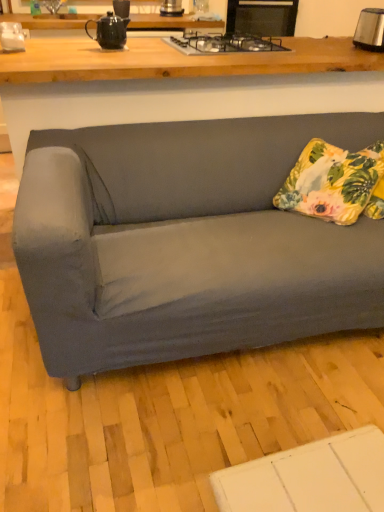
This screenshot has width=384, height=512. Describe the element at coordinates (179, 84) in the screenshot. I see `matte wood desk at upper center` at that location.

The height and width of the screenshot is (512, 384). In order to click on floral fabric pillow at right in this screenshot , I will do `click(335, 183)`.

In the scene shown: What is the approximate width of black glass gas stove at upper center?

51.57 centimeters.

Describe the element at coordinates (108, 31) in the screenshot. I see `matte black teapot at upper center` at that location.

The image size is (384, 512). Find the location of `matte wood desk at upper center`. matte wood desk at upper center is located at coordinates (179, 84).

From a real-world perspective, which object rests below the other?

In real-world perspective, floral fabric pillow at right is lower.

Is satin silver toaster at upper right positioned with its back to floral fabric pillow at right?

No, satin silver toaster at upper right is not facing the opposite direction of floral fabric pillow at right.

At what (x,y) coordinates should I click in order to perform the action: click on pillow to the left of satin silver toaster at upper right. Please return your answer as a coordinate pair (x, y). Looking at the image, I should click on (335, 183).

Is satin silver toaster at upper right taller than floral fabric pillow at right?

In fact, satin silver toaster at upper right may be shorter than floral fabric pillow at right.

Relative to black glass gas stove at upper center, is satin silver toaster at upper right in front or behind?

Visually, satin silver toaster at upper right is located behind black glass gas stove at upper center.

Based on the photo, from a real-world perspective, between satin silver toaster at upper right and black glass gas stove at upper center, who is vertically lower?

black glass gas stove at upper center.

Choose the correct answer: Is satin silver toaster at upper right inside black glass gas stove at upper center or outside it?

satin silver toaster at upper right lies outside black glass gas stove at upper center.

Is satin silver toaster at upper right looking in the opposite direction of black glass gas stove at upper center?

No, satin silver toaster at upper right is not facing away from black glass gas stove at upper center.

What's the angular difference between floral fabric pillow at right and black glass gas stove at upper center's facing directions?

The angle between the facing direction of floral fabric pillow at right and the facing direction of black glass gas stove at upper center is 125 degrees.

Are floral fabric pillow at right and black glass gas stove at upper center located far from each other?

Actually, floral fabric pillow at right and black glass gas stove at upper center are a little close together.

From the picture: Could you tell me if floral fabric pillow at right is turned towards black glass gas stove at upper center?

No, floral fabric pillow at right is not facing towards black glass gas stove at upper center.

Which object is wider, white glossy coffee maker at upper left, the 1th appliance in the left-to-right sequence, or metallic silver toaster at upper center, placed as the second appliance when sorted from left to right?

metallic silver toaster at upper center, placed as the second appliance when sorted from left to right, is wider.

Can you confirm if white glossy coffee maker at upper left, the 2th appliance when ordered from top to bottom, is positioned to the right of metallic silver toaster at upper center, which appears as the 2th appliance when ordered from the bottom?

No, white glossy coffee maker at upper left, the 2th appliance when ordered from top to bottom, is not to the right of metallic silver toaster at upper center, which appears as the 2th appliance when ordered from the bottom.

From the image's perspective, which object appears higher, white glossy coffee maker at upper left, which ranks as the first appliance in front-to-back order, or metallic silver toaster at upper center, the 1th appliance from the back?

metallic silver toaster at upper center, the 1th appliance from the back.

Are white glossy coffee maker at upper left, the 1th appliance when ordered from bottom to top, and metallic silver toaster at upper center, positioned as the first appliance in right-to-left order, far apart?

white glossy coffee maker at upper left, the 1th appliance when ordered from bottom to top, is far away from metallic silver toaster at upper center, positioned as the first appliance in right-to-left order.

Based on the photo, is floral fabric pillow at right facing towards satin silver toaster at upper right?

No, floral fabric pillow at right is not aimed at satin silver toaster at upper right.

Which of these two, floral fabric pillow at right or satin silver toaster at upper right, is wider?

floral fabric pillow at right.

From a real-world perspective, between floral fabric pillow at right and satin silver toaster at upper right, who is vertically higher?

satin silver toaster at upper right, from a real-world perspective.

Which of these two, floral fabric pillow at right or satin silver toaster at upper right, is bigger?

floral fabric pillow at right is bigger.

In terms of size, does metallic silver toaster at upper center, positioned as the first appliance in right-to-left order, appear bigger or smaller than matte wood desk at upper center?

metallic silver toaster at upper center, positioned as the first appliance in right-to-left order, is smaller than matte wood desk at upper center.

Can you confirm if metallic silver toaster at upper center, which appears as the 2th appliance when ordered from the bottom, is positioned to the left of matte wood desk at upper center?

Indeed, metallic silver toaster at upper center, which appears as the 2th appliance when ordered from the bottom, is positioned on the left side of matte wood desk at upper center.

From the image's perspective, who appears lower, metallic silver toaster at upper center, placed as the second appliance when sorted from left to right, or matte wood desk at upper center?

matte wood desk at upper center.

Which is in front, metallic silver toaster at upper center, acting as the first appliance starting from the top, or matte wood desk at upper center?

matte wood desk at upper center.

Is black glass gas stove at upper center at the right side of white glossy coffee maker at upper left, the 2th appliance when ordered from top to bottom?

Indeed, black glass gas stove at upper center is positioned on the right side of white glossy coffee maker at upper left, the 2th appliance when ordered from top to bottom.

What's the angular difference between black glass gas stove at upper center and white glossy coffee maker at upper left, the 1th appliance when ordered from bottom to top,'s facing directions?

The angle between the facing direction of black glass gas stove at upper center and the facing direction of white glossy coffee maker at upper left, the 1th appliance when ordered from bottom to top, is 0.00178 degrees.

Looking at this image, considering the sizes of objects black glass gas stove at upper center and white glossy coffee maker at upper left, the 1th appliance in the left-to-right sequence, in the image provided, who is shorter, black glass gas stove at upper center or white glossy coffee maker at upper left, the 1th appliance in the left-to-right sequence,?

black glass gas stove at upper center is shorter.

Image resolution: width=384 pixels, height=512 pixels. Find the location of `toaster behind the floral fabric pillow at right`. toaster behind the floral fabric pillow at right is located at coordinates (370, 30).

Locate an element on the screen. toaster above the black glass gas stove at upper center (from the image's perspective) is located at coordinates (370, 30).

Based on their spatial positions, is matte black teapot at upper center or floral fabric pillow at right closer to matte wood desk at upper center?

floral fabric pillow at right is positioned closer to the anchor matte wood desk at upper center.

Which object lies nearer to the anchor point matte wood desk at upper center, black glass gas stove at upper center or matte black teapot at upper center?

black glass gas stove at upper center lies closer to matte wood desk at upper center than the other object.

Considering their positions, is black glass gas stove at upper center positioned closer to white glossy coffee maker at upper left, the 1th appliance in the left-to-right sequence, than matte wood desk at upper center?

matte wood desk at upper center.

Considering their positions, is floral fabric pillow at right positioned further to white glossy coffee maker at upper left, the 2th appliance when ordered from top to bottom, than metallic silver toaster at upper center, positioned as the first appliance in right-to-left order?

The object further to white glossy coffee maker at upper left, the 2th appliance when ordered from top to bottom, is metallic silver toaster at upper center, positioned as the first appliance in right-to-left order.

Based on their spatial positions, is floral fabric pillow at right or satin silver toaster at upper right closer to white glossy coffee maker at upper left, the 1th appliance in the left-to-right sequence?

floral fabric pillow at right is positioned closer to the anchor white glossy coffee maker at upper left, the 1th appliance in the left-to-right sequence.

Considering their positions, is matte black teapot at upper center positioned closer to satin silver toaster at upper right than matte wood desk at upper center?

matte wood desk at upper center is positioned closer to the anchor satin silver toaster at upper right.

From the image, which object appears to be farther from matte wood desk at upper center, metallic silver toaster at upper center, which appears as the 2th appliance when ordered from the bottom, or matte black teapot at upper center?

metallic silver toaster at upper center, which appears as the 2th appliance when ordered from the bottom, is further to matte wood desk at upper center.

Which object lies further to the anchor point black glass gas stove at upper center, satin silver toaster at upper right or metallic silver toaster at upper center, placed as the second appliance when sorted from left to right?

The object further to black glass gas stove at upper center is metallic silver toaster at upper center, placed as the second appliance when sorted from left to right.

Identify the location of kitchen appliance situated between white glossy coffee maker at upper left, the 2th appliance when ordered from back to front, and matte wood desk at upper center from left to right. (108, 31).

The width and height of the screenshot is (384, 512). In order to click on kitchen appliance positioned between white glossy coffee maker at upper left, the 1th appliance in the left-to-right sequence, and metallic silver toaster at upper center, the 1th appliance from the back, from near to far in this screenshot , I will do (108, 31).

The height and width of the screenshot is (512, 384). I want to click on pillow between matte black teapot at upper center and satin silver toaster at upper right, so click(x=335, y=183).

The image size is (384, 512). In order to click on kitchen appliance between white glossy coffee maker at upper left, which appears as the 2th appliance when viewed from the right, and satin silver toaster at upper right from left to right in this screenshot , I will do `click(108, 31)`.